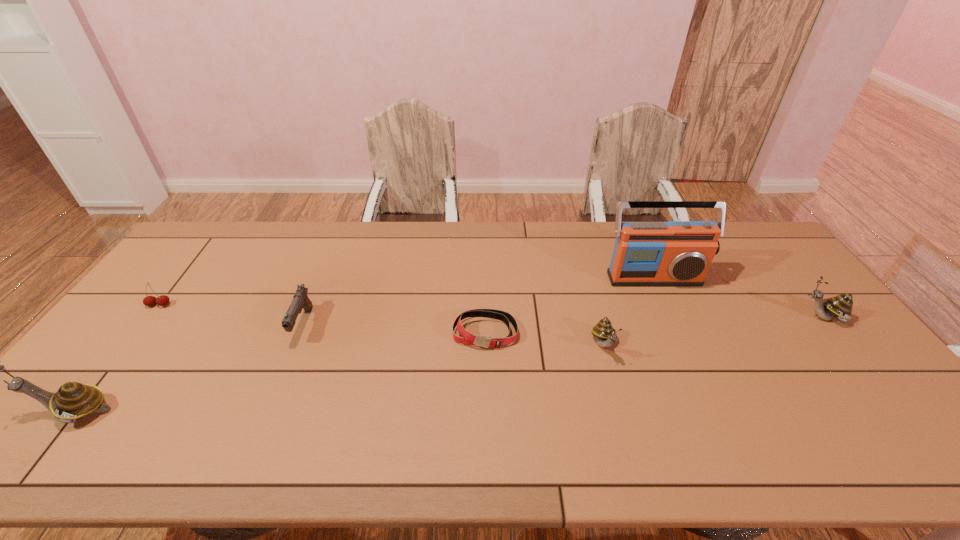
You are a GUI agent. You are given a task and a screenshot of the screen. Output one action in this format:
    pyautogui.click(x=<x>, y=<y>)
    Task: Click on the vacant space that's between the shortest snail and the shortest object
    The height and width of the screenshot is (540, 960).
    Given the screenshot: What is the action you would take?
    pyautogui.click(x=545, y=339)

Find the location of `vacant area that lies between the sixth object from left to right and the dog collar`. vacant area that lies between the sixth object from left to right and the dog collar is located at coordinates (569, 305).

You are a GUI agent. You are given a task and a screenshot of the screen. Output one action in this format:
    pyautogui.click(x=<x>, y=<y>)
    Task: Click on the free point between the second nearest snail and the dog collar
    Image resolution: width=960 pixels, height=540 pixels.
    Given the screenshot: What is the action you would take?
    pyautogui.click(x=545, y=339)

You are a GUI agent. You are given a task and a screenshot of the screen. Output one action in this format:
    pyautogui.click(x=<x>, y=<y>)
    Task: Click on the free spot between the gun and the farthest snail
    This screenshot has width=960, height=540.
    Given the screenshot: What is the action you would take?
    pyautogui.click(x=563, y=321)

I want to click on free area in between the third object from left to right and the shortest object, so click(x=394, y=329).

Locate an element on the screen. free space between the second tallest snail and the tallest object is located at coordinates (737, 298).

Find the location of a particular element. The image size is (960, 540). vacant point located between the nearest snail and the radio receiver is located at coordinates (364, 345).

Image resolution: width=960 pixels, height=540 pixels. I want to click on blank region between the radio receiver and the cherry, so click(x=406, y=292).

Identify which object is located as the second nearest to the cherry. Please provide its 2D coordinates. Your answer should be formatted as a tuple, i.e. [(x, y)], where the tuple contains the x and y coordinates of a point satisfying the conditions above.

[(300, 301)]

Choose which object is the nearest neighbor to the farthest snail. Please provide its 2D coordinates. Your answer should be formatted as a tuple, i.e. [(x, y)], where the tuple contains the x and y coordinates of a point satisfying the conditions above.

[(676, 253)]